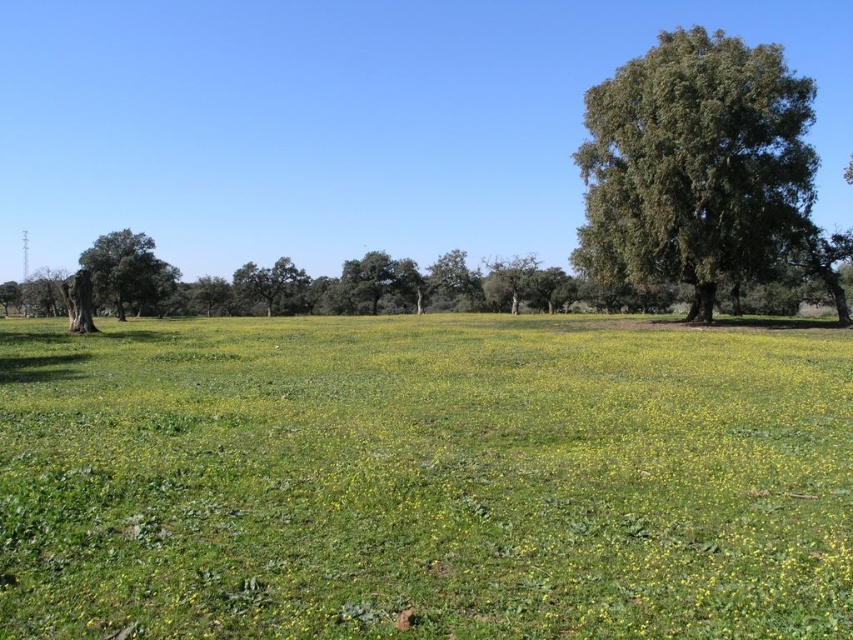
Question: Based on their relative distances, which object is nearer to the green leafy tree at right?

Choices:
 (A) green grassy field at center
 (B) smooth green tree at left
 (C) green matte tree at center

Answer: (A)

Question: Based on their relative distances, which object is farther from the smooth green tree at left?

Choices:
 (A) green matte tree at center
 (B) green grassy field at center

Answer: (B)

Question: Does green grassy field at center appear under green leafy tree at right?

Choices:
 (A) no
 (B) yes

Answer: (B)

Question: Estimate the real-world distances between objects in this image. Which object is farther from the green leafy tree at right?

Choices:
 (A) smooth green tree at left
 (B) green grassy field at center
 (C) green matte tree at center

Answer: (C)

Question: Does smooth green tree at left come behind green matte tree at center?

Choices:
 (A) yes
 (B) no

Answer: (B)

Question: Does green leafy tree at right come in front of green matte tree at center?

Choices:
 (A) yes
 (B) no

Answer: (A)